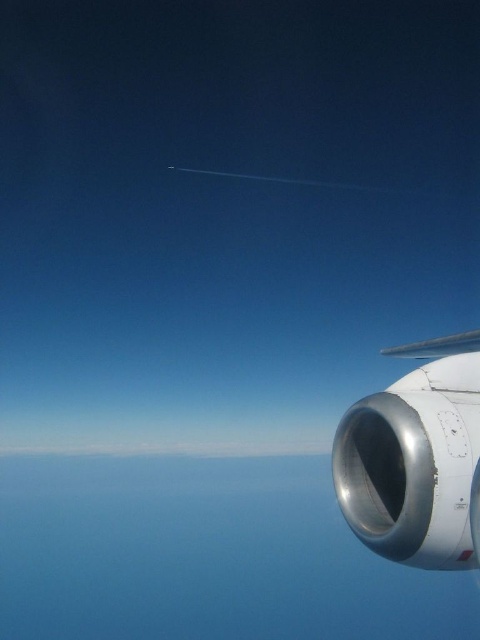
Question: Where is metallic jet engine at right located in relation to silver metallic wing at upper right in the image?

Choices:
 (A) below
 (B) above

Answer: (A)

Question: Can you confirm if metallic jet engine at right is thinner than silver metallic wing at upper right?

Choices:
 (A) no
 (B) yes

Answer: (A)

Question: Does metallic jet engine at right have a greater width compared to silver metallic wing at upper right?

Choices:
 (A) yes
 (B) no

Answer: (A)

Question: Which object is closer to the camera taking this photo?

Choices:
 (A) silver metallic wing at upper right
 (B) metallic jet engine at right

Answer: (B)